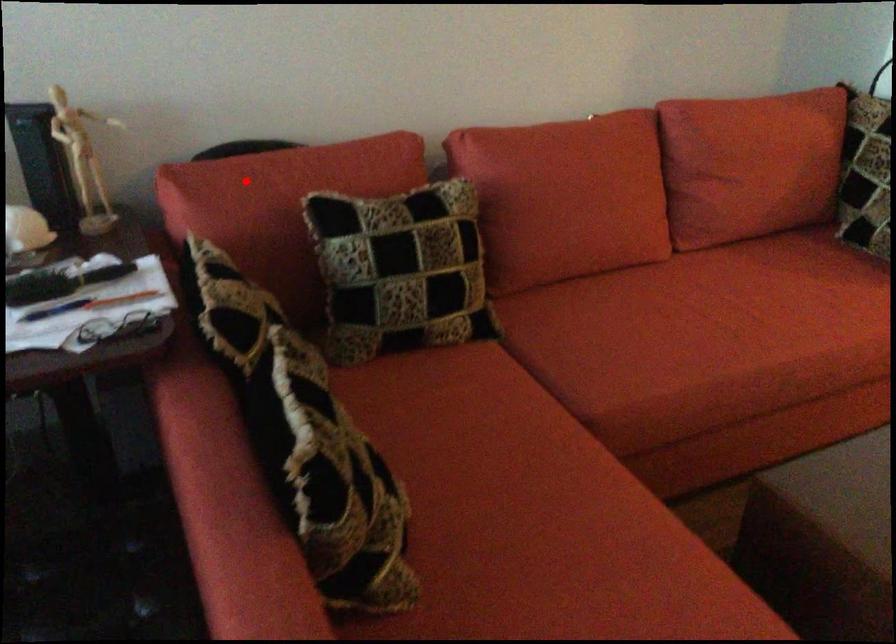
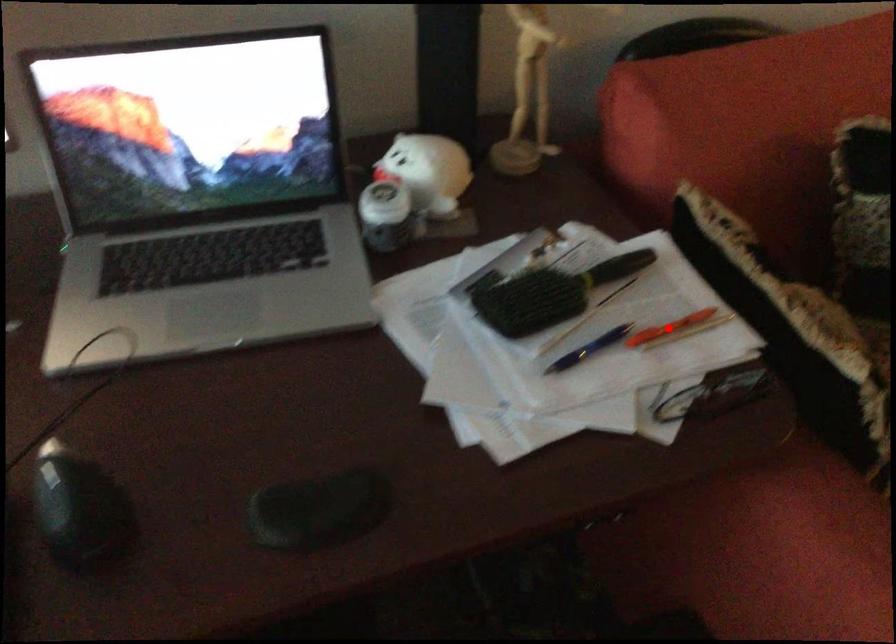
I am providing you with two images of the same scene from different viewpoints. A red point is marked on the first image and another point is marked on the second image. Is the red point in image1 aligned with the point shown in image2?

No